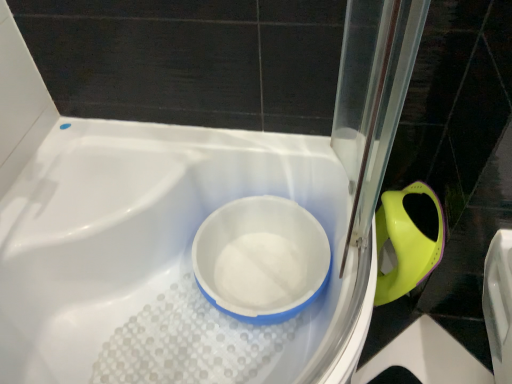
Question: Is matte green plastic bidet at right turned away from white plastic bath at center?

Choices:
 (A) yes
 (B) no

Answer: (B)

Question: Is matte green plastic bidet at right aimed at white plastic bath at center?

Choices:
 (A) yes
 (B) no

Answer: (B)

Question: Is matte green plastic bidet at right to the right of white plastic bath at center from the viewer's perspective?

Choices:
 (A) yes
 (B) no

Answer: (A)

Question: Can you confirm if matte green plastic bidet at right is taller than white plastic bath at center?

Choices:
 (A) no
 (B) yes

Answer: (A)

Question: Is matte green plastic bidet at right wider than white plastic bath at center?

Choices:
 (A) yes
 (B) no

Answer: (B)

Question: Is white plastic bath at center a part of matte green plastic bidet at right?

Choices:
 (A) no
 (B) yes

Answer: (A)

Question: Is white plastic bath at center facing towards white plastic bowl at center?

Choices:
 (A) yes
 (B) no

Answer: (A)

Question: Is white plastic bath at center further to the viewer compared to white plastic bowl at center?

Choices:
 (A) yes
 (B) no

Answer: (B)

Question: Considering the relative sizes of white plastic bath at center and white plastic bowl at center in the image provided, is white plastic bath at center shorter than white plastic bowl at center?

Choices:
 (A) yes
 (B) no

Answer: (B)

Question: From a real-world perspective, is white plastic bath at center positioned under white plastic bowl at center based on gravity?

Choices:
 (A) no
 (B) yes

Answer: (B)

Question: Can you confirm if white plastic bath at center is bigger than white plastic bowl at center?

Choices:
 (A) no
 (B) yes

Answer: (B)

Question: Is white plastic bath at center in front of white plastic bowl at center?

Choices:
 (A) no
 (B) yes

Answer: (B)

Question: Does white plastic bath at center have a greater width compared to matte green plastic bidet at right?

Choices:
 (A) yes
 (B) no

Answer: (A)